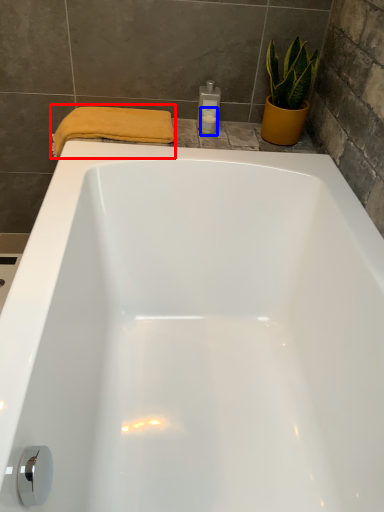
Question: Among these objects, which one is farthest to the camera, bath towel (highlighted by a red box) or toiletry (highlighted by a blue box)?

Choices:
 (A) bath towel
 (B) toiletry

Answer: (B)